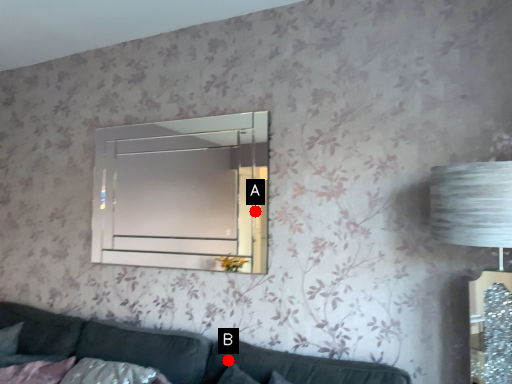
Question: Two points are circled on the image, labeled by A and B beside each circle. Which of the following is the farthest from the observer?

Choices:
 (A) A is further
 (B) B is further

Answer: (A)